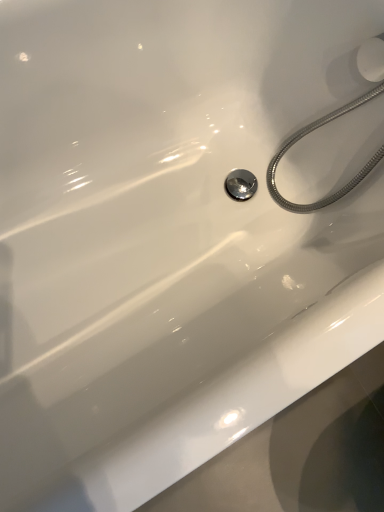
Describe the element at coordinates (307, 134) in the screenshot. I see `metallic silver shower hose at upper right` at that location.

The width and height of the screenshot is (384, 512). I want to click on metallic silver shower hose at upper right, so click(307, 134).

You are a GUI agent. You are given a task and a screenshot of the screen. Output one action in this format:
    pyautogui.click(x=<x>, y=<y>)
    Task: Click on the metallic silver shower hose at upper right
    
    Given the screenshot: What is the action you would take?
    pyautogui.click(x=307, y=134)